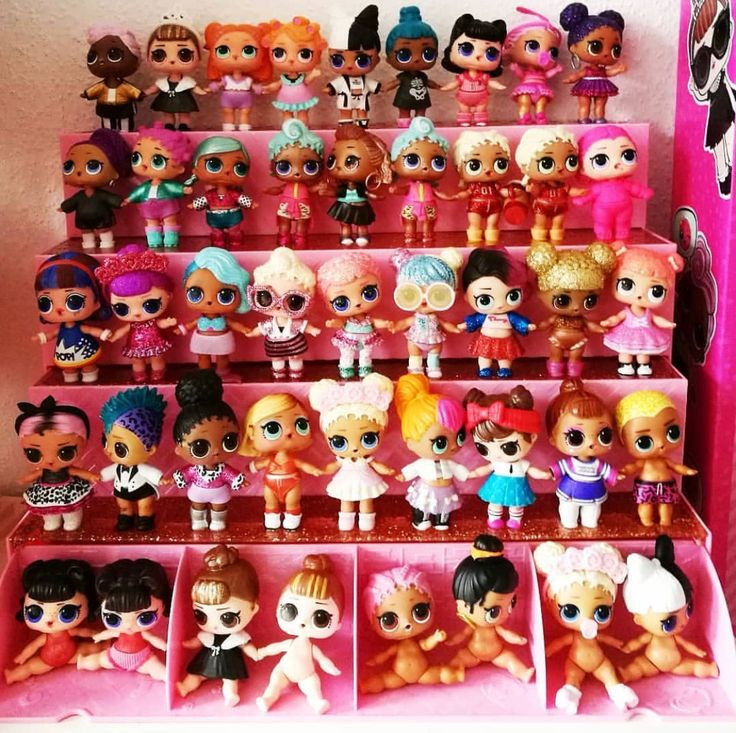
This screenshot has height=733, width=736. In order to click on dolls in top row in this screenshot , I will do `click(592, 40)`, `click(550, 43)`, `click(478, 45)`, `click(421, 45)`, `click(361, 58)`, `click(288, 43)`, `click(241, 44)`, `click(165, 51)`, `click(116, 51)`.